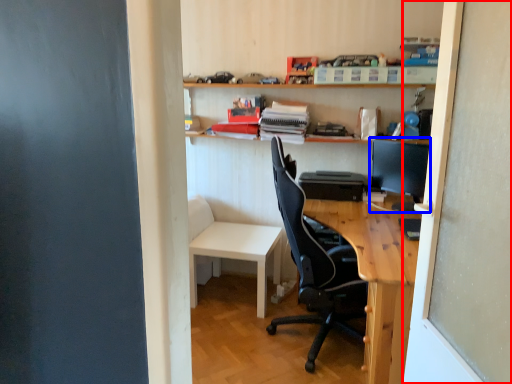
Question: Which of the following is the closest to the observer, screen door (highlighted by a red box) or computer monitor (highlighted by a blue box)?

Choices:
 (A) screen door
 (B) computer monitor

Answer: (A)